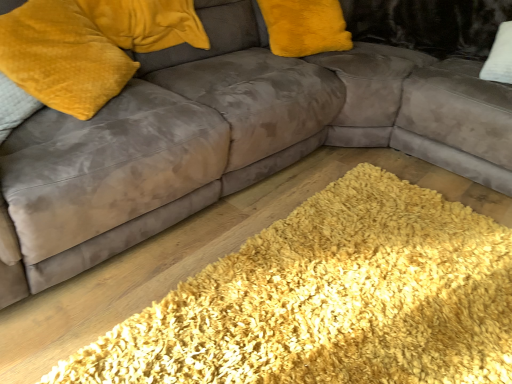
Find the location of `shaggy yellow rug at lower center`. shaggy yellow rug at lower center is located at coordinates (330, 300).

What do you see at coordinates (330, 300) in the screenshot?
I see `shaggy yellow rug at lower center` at bounding box center [330, 300].

Image resolution: width=512 pixels, height=384 pixels. Describe the element at coordinates (62, 57) in the screenshot. I see `velvet yellow pillow at upper left` at that location.

In order to face velvet yellow pillow at upper left, should I rotate leftwards or rightwards?

Rotate left and turn 24.272 degrees.

This screenshot has width=512, height=384. In order to click on velvet yellow pillow at upper left in this screenshot , I will do `click(62, 57)`.

Where is `shaggy yellow rug at lower center`? shaggy yellow rug at lower center is located at coordinates (330, 300).

Which is more to the left, shaggy yellow rug at lower center or velvet yellow pillow at upper left?

velvet yellow pillow at upper left is more to the left.

Considering the positions of objects shaggy yellow rug at lower center and velvet yellow pillow at upper left in the image provided, who is in front, shaggy yellow rug at lower center or velvet yellow pillow at upper left?

shaggy yellow rug at lower center.

Is point (397, 332) less distant than point (102, 102)?

That is True.

From the image's perspective, is shaggy yellow rug at lower center located above or below velvet yellow pillow at upper left?

Clearly, from the image's perspective, shaggy yellow rug at lower center is below velvet yellow pillow at upper left.

From a real-world perspective, who is located lower, shaggy yellow rug at lower center or velvet yellow pillow at upper left?

shaggy yellow rug at lower center is physically lower.

Can you confirm if shaggy yellow rug at lower center is wider than velvet yellow pillow at upper left?

Indeed, shaggy yellow rug at lower center has a greater width compared to velvet yellow pillow at upper left.

Who is shorter, shaggy yellow rug at lower center or velvet yellow pillow at upper left?

shaggy yellow rug at lower center.

Is shaggy yellow rug at lower center smaller than velvet yellow pillow at upper left?

No.

Is velvet yellow pillow at upper left inside shaggy yellow rug at lower center?

Actually, velvet yellow pillow at upper left is outside shaggy yellow rug at lower center.

Is shaggy yellow rug at lower center with velvet yellow pillow at upper left?

No.

Is shaggy yellow rug at lower center oriented towards velvet yellow pillow at upper left?

No, shaggy yellow rug at lower center is not turned towards velvet yellow pillow at upper left.

What's the angular difference between shaggy yellow rug at lower center and velvet yellow pillow at upper left's facing directions?

The angular difference between shaggy yellow rug at lower center and velvet yellow pillow at upper left is 36.6 degrees.

Find the location of a particular element. Image resolution: width=512 pixels, height=384 pixels. pillow on the left of shaggy yellow rug at lower center is located at coordinates (62, 57).

Can you confirm if velvet yellow pillow at upper left is positioned to the left of shaggy yellow rug at lower center?

Yes.

Considering the positions of objects velvet yellow pillow at upper left and shaggy yellow rug at lower center in the image provided, who is in front, velvet yellow pillow at upper left or shaggy yellow rug at lower center?

Positioned in front is shaggy yellow rug at lower center.

Which point is more distant from viewer, (6, 30) or (497, 280)?

Positioned behind is point (497, 280).

From the image's perspective, is velvet yellow pillow at upper left over shaggy yellow rug at lower center?

Yes.

From a real-world perspective, is velvet yellow pillow at upper left positioned above or below shaggy yellow rug at lower center?

velvet yellow pillow at upper left is situated higher than shaggy yellow rug at lower center in the real world.

Which object is wider, velvet yellow pillow at upper left or shaggy yellow rug at lower center?

Wider between the two is shaggy yellow rug at lower center.

In terms of height, does velvet yellow pillow at upper left look taller or shorter compared to shaggy yellow rug at lower center?

Clearly, velvet yellow pillow at upper left is taller compared to shaggy yellow rug at lower center.

Looking at the image, does velvet yellow pillow at upper left seem bigger or smaller compared to shaggy yellow rug at lower center?

Clearly, velvet yellow pillow at upper left is smaller in size than shaggy yellow rug at lower center.

Would you say velvet yellow pillow at upper left contains shaggy yellow rug at lower center?

Definitely not — shaggy yellow rug at lower center is not inside velvet yellow pillow at upper left.

Is the surface of velvet yellow pillow at upper left in direct contact with shaggy yellow rug at lower center?

No, velvet yellow pillow at upper left is not making contact with shaggy yellow rug at lower center.

Is velvet yellow pillow at upper left facing away from shaggy yellow rug at lower center?

That's not correct — velvet yellow pillow at upper left is not looking away from shaggy yellow rug at lower center.

How much distance is there between velvet yellow pillow at upper left and shaggy yellow rug at lower center?

A distance of 36.91 inches exists between velvet yellow pillow at upper left and shaggy yellow rug at lower center.

This screenshot has width=512, height=384. Find the location of `pillow on the left of the shaggy yellow rug at lower center`. pillow on the left of the shaggy yellow rug at lower center is located at coordinates (62, 57).

Identify the location of mat in front of the velvet yellow pillow at upper left. (330, 300).

Identify the location of mat below the velvet yellow pillow at upper left (from a real-world perspective). The width and height of the screenshot is (512, 384). (330, 300).